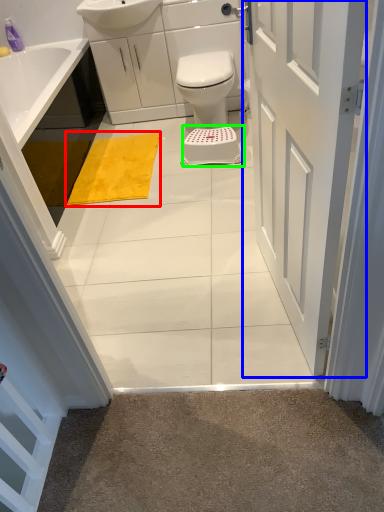
Question: Based on their relative distances, which object is farther from bath mat (highlighted by a red box)? Choose from door (highlighted by a blue box) and stool (highlighted by a green box).

Choices:
 (A) door
 (B) stool

Answer: (A)